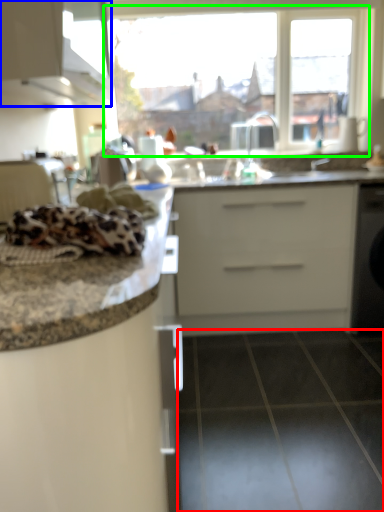
Question: Estimate the real-world distances between objects in this image. Which object is farther from tile (highlighted by a red box), cabinetry (highlighted by a blue box) or window (highlighted by a green box)?

Choices:
 (A) cabinetry
 (B) window

Answer: (B)